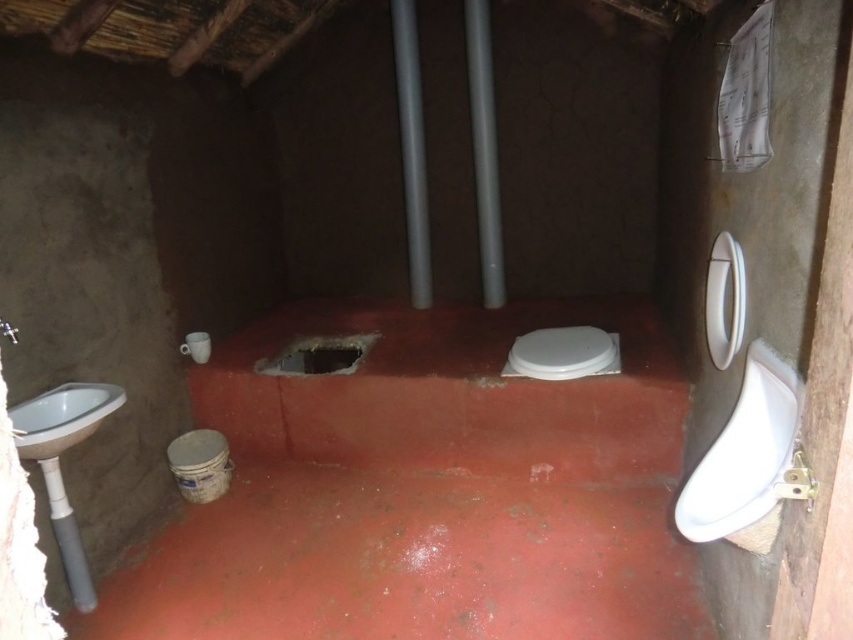
Question: Is smooth concrete floor at center further to the viewer compared to white glossy toilet bowl at center?

Choices:
 (A) yes
 (B) no

Answer: (B)

Question: Which object is the closest to the white glossy toilet bowl at center?

Choices:
 (A) smooth concrete floor at center
 (B) white glossy sink at left

Answer: (A)

Question: Estimate the real-world distances between objects in this image. Which object is closer to the white glossy toilet bowl at center?

Choices:
 (A) smooth concrete floor at center
 (B) white glossy sink at left

Answer: (A)

Question: Can you confirm if smooth concrete floor at center is positioned above white glossy sink at left?

Choices:
 (A) no
 (B) yes

Answer: (A)

Question: Is smooth concrete floor at center bigger than white glossy toilet bowl at center?

Choices:
 (A) yes
 (B) no

Answer: (A)

Question: Considering the real-world distances, which object is farthest from the white glossy sink at left?

Choices:
 (A) smooth concrete floor at center
 (B) white glossy toilet bowl at center

Answer: (B)